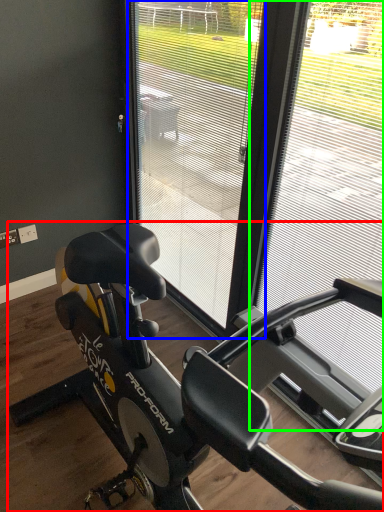
Question: Considering the real-world distances, which object is closest to stationary bicycle (highlighted by a red box)? screen door (highlighted by a blue box) or window frame (highlighted by a green box).

Choices:
 (A) screen door
 (B) window frame

Answer: (B)